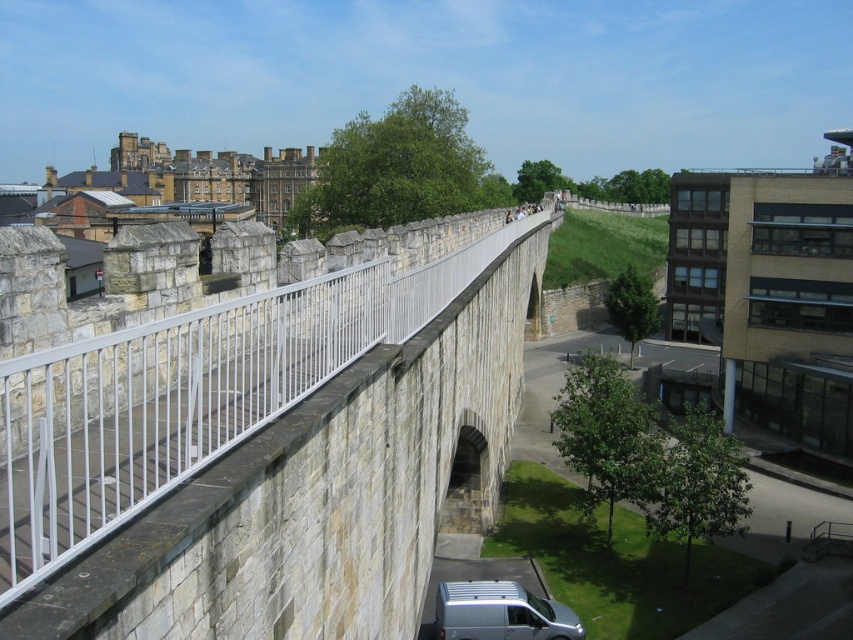
Question: Which of the following is the farthest from the observer?

Choices:
 (A) (434, 608)
 (B) (363, 442)

Answer: (A)

Question: Which object is closer to the camera taking this photo?

Choices:
 (A) silver metallic van at lower center
 (B) stone bridge at center

Answer: (B)

Question: Is stone bridge at center below silver metallic van at lower center?

Choices:
 (A) yes
 (B) no

Answer: (B)

Question: Is stone bridge at center smaller than silver metallic van at lower center?

Choices:
 (A) no
 (B) yes

Answer: (A)

Question: Is stone bridge at center positioned at the back of silver metallic van at lower center?

Choices:
 (A) no
 (B) yes

Answer: (A)

Question: Among these objects, which one is nearest to the camera?

Choices:
 (A) silver metallic van at lower center
 (B) stone bridge at center

Answer: (B)